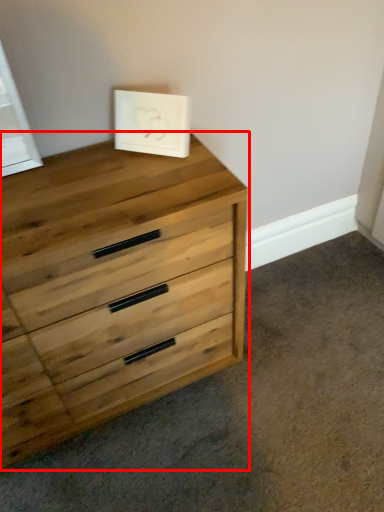
Question: Considering the relative positions of chest of drawers (annotated by the red box) and picture frame in the image provided, where is chest of drawers (annotated by the red box) located with respect to the staircase?

Choices:
 (A) left
 (B) right

Answer: (A)